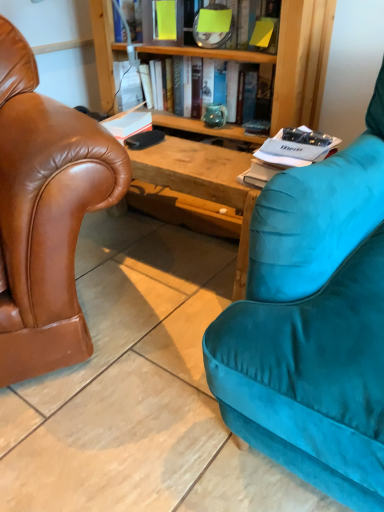
I want to click on white matte book at center, which appears as the 3th book when viewed from the top, so click(x=128, y=123).

Identify the location of matte ceramic vase at center. The image size is (384, 512). (215, 115).

Image resolution: width=384 pixels, height=512 pixels. What do you see at coordinates (287, 154) in the screenshot?
I see `white paper at right, marked as the 4th book in a top-to-bottom arrangement` at bounding box center [287, 154].

At what (x,y) coordinates should I click in order to perform the action: click on yellow paper at upper center, which is the first book in top-to-bottom order. Please return your answer as a coordinate pair (x, y). Looking at the image, I should click on (218, 35).

How much distance is there between white paper at right, marked as the 4th book in a top-to-bottom arrangement, and matte green vase at center, the 3th book when ordered from bottom to top?

white paper at right, marked as the 4th book in a top-to-bottom arrangement, and matte green vase at center, the 3th book when ordered from bottom to top, are 18.85 inches apart.

In the scene shown: Can you confirm if white paper at right, marked as the 4th book in a top-to-bottom arrangement, is positioned to the left of matte green vase at center, which is counted as the 2th book, starting from the top?

In fact, white paper at right, marked as the 4th book in a top-to-bottom arrangement, is to the right of matte green vase at center, which is counted as the 2th book, starting from the top.

From a real-world perspective, which book is the 1st one above the white paper at right, marked as the 4th book in a top-to-bottom arrangement? Please provide its 2D coordinates.

[(214, 55)]

From the image's perspective, does white paper at right, marked as the 4th book in a top-to-bottom arrangement, appear higher than matte green vase at center, which is counted as the 2th book, starting from the top?

No, from the image's perspective, white paper at right, marked as the 4th book in a top-to-bottom arrangement, is not on top of matte green vase at center, which is counted as the 2th book, starting from the top.

Can you tell me how much matte green vase at center, the 3th book when ordered from bottom to top, and white matte book at center, the 2th book when ordered from bottom to top, differ in facing direction?

There is a 5.5-degree angle between the facing directions of matte green vase at center, the 3th book when ordered from bottom to top, and white matte book at center, the 2th book when ordered from bottom to top.

Is matte green vase at center, the 3th book when ordered from bottom to top, wider or thinner than white matte book at center, the 2th book when ordered from bottom to top?

matte green vase at center, the 3th book when ordered from bottom to top, is thinner than white matte book at center, the 2th book when ordered from bottom to top.

Which is correct: matte green vase at center, which is counted as the 2th book, starting from the top, is inside white matte book at center, which appears as the 3th book when viewed from the top, or outside of it?

matte green vase at center, which is counted as the 2th book, starting from the top, is spatially situated outside white matte book at center, which appears as the 3th book when viewed from the top.

Where is `the 1st book below the matte green vase at center, which is counted as the 2th book, starting from the top (from the image's perspective)`? This screenshot has width=384, height=512. the 1st book below the matte green vase at center, which is counted as the 2th book, starting from the top (from the image's perspective) is located at coordinates (128, 123).

Can you tell me how much white matte book at center, the 2th book when ordered from bottom to top, and matte green vase at center, the 3th book when ordered from bottom to top, differ in facing direction?

There is a 5.5-degree angle between the facing directions of white matte book at center, the 2th book when ordered from bottom to top, and matte green vase at center, the 3th book when ordered from bottom to top.

Is white matte book at center, the 2th book when ordered from bottom to top, looking in the opposite direction of matte green vase at center, which is counted as the 2th book, starting from the top?

Yes, white matte book at center, the 2th book when ordered from bottom to top, is positioned with its back facing matte green vase at center, which is counted as the 2th book, starting from the top.

You are a GUI agent. You are given a task and a screenshot of the screen. Output one action in this format:
    pyautogui.click(x=<x>, y=<y>)
    Task: Click on the book that is the 1st one when counting rightward from the white matte book at center, the 2th book when ordered from bottom to top
    The width and height of the screenshot is (384, 512).
    Given the screenshot: What is the action you would take?
    pyautogui.click(x=214, y=55)

Is white matte book at center, the 2th book when ordered from bottom to top, closer to the viewer compared to matte green vase at center, the 3th book when ordered from bottom to top?

That is False.

Would you say white paper at right, the first book when ordered from bottom to top, is inside or outside matte ceramic vase at center?

white paper at right, the first book when ordered from bottom to top, is spatially situated outside matte ceramic vase at center.

Identify the location of book that is the 1st one above the matte ceramic vase at center (from a real-world perspective). This screenshot has height=512, width=384. (287, 154).

From a real-world perspective, relative to matte ceramic vase at center, is white paper at right, the first book when ordered from bottom to top, vertically above or below?

Clearly, from a real-world perspective, white paper at right, the first book when ordered from bottom to top, is above matte ceramic vase at center.

Is matte ceramic vase at center positioned behind yellow paper at upper center, the 4th book when ordered from bottom to top?

That is True.

Could you measure the distance between matte ceramic vase at center and yellow paper at upper center, the 4th book when ordered from bottom to top?

matte ceramic vase at center is 11.53 inches from yellow paper at upper center, the 4th book when ordered from bottom to top.

Can you confirm if matte ceramic vase at center is bigger than yellow paper at upper center, which is the first book in top-to-bottom order?

Actually, matte ceramic vase at center might be smaller than yellow paper at upper center, which is the first book in top-to-bottom order.

Is point (222, 121) farther from viewer compared to point (220, 44)?

Yes, point (222, 121) is behind point (220, 44).

Can you tell me how much white matte book at center, which appears as the 3th book when viewed from the top, and matte ceramic vase at center differ in facing direction?

5.5 degrees separate the facing orientations of white matte book at center, which appears as the 3th book when viewed from the top, and matte ceramic vase at center.

Considering the positions of points (115, 127) and (214, 108), is point (115, 127) farther from camera compared to point (214, 108)?

No, it is in front of (214, 108).

Based on the photo, considering the relative sizes of white matte book at center, which appears as the 3th book when viewed from the top, and matte ceramic vase at center in the image provided, is white matte book at center, which appears as the 3th book when viewed from the top, bigger than matte ceramic vase at center?

Indeed, white matte book at center, which appears as the 3th book when viewed from the top, has a larger size compared to matte ceramic vase at center.

Considering the positions of objects white matte book at center, which appears as the 3th book when viewed from the top, and matte ceramic vase at center in the image provided, who is behind, white matte book at center, which appears as the 3th book when viewed from the top, or matte ceramic vase at center?

matte ceramic vase at center is behind.

Does matte ceramic vase at center come in front of white paper at right, the first book when ordered from bottom to top?

That is False.

In the scene shown: Is matte ceramic vase at center inside the boundaries of white paper at right, marked as the 4th book in a top-to-bottom arrangement, or outside?

The correct answer is: outside.

From the image's perspective, is matte ceramic vase at center below white paper at right, the first book when ordered from bottom to top?

Incorrect, from the image's perspective, matte ceramic vase at center is higher than white paper at right, the first book when ordered from bottom to top.

I want to click on the 2nd book above when counting from the white paper at right, the first book when ordered from bottom to top (from the image's perspective), so click(214, 55).

At what (x,y) coordinates should I click in order to perform the action: click on the 1st book below the matte green vase at center, the 3th book when ordered from bottom to top (from the image's perspective). Please return your answer as a coordinate pair (x, y). Looking at the image, I should click on (128, 123).

From the image, which object appears to be farther from white matte book at center, the 2th book when ordered from bottom to top, yellow paper at upper center, the 4th book when ordered from bottom to top, or matte green vase at center, the 3th book when ordered from bottom to top?

yellow paper at upper center, the 4th book when ordered from bottom to top, is further to white matte book at center, the 2th book when ordered from bottom to top.

Which object lies further to the anchor point matte ceramic vase at center, yellow paper at upper center, which is the first book in top-to-bottom order, or white matte book at center, the 2th book when ordered from bottom to top?

white matte book at center, the 2th book when ordered from bottom to top.

When comparing their distances from matte green vase at center, which is counted as the 2th book, starting from the top, does yellow paper at upper center, which is the first book in top-to-bottom order, or white matte book at center, which appears as the 3th book when viewed from the top, seem closer?

yellow paper at upper center, which is the first book in top-to-bottom order, lies closer to matte green vase at center, which is counted as the 2th book, starting from the top, than the other object.

Estimate the real-world distances between objects in this image. Which object is further from yellow paper at upper center, which is the first book in top-to-bottom order, matte ceramic vase at center or matte green vase at center, which is counted as the 2th book, starting from the top?

matte ceramic vase at center is positioned further to the anchor yellow paper at upper center, which is the first book in top-to-bottom order.

When comparing their distances from white paper at right, marked as the 4th book in a top-to-bottom arrangement, does matte green vase at center, the 3th book when ordered from bottom to top, or yellow paper at upper center, which is the first book in top-to-bottom order, seem further?

The object further to white paper at right, marked as the 4th book in a top-to-bottom arrangement, is yellow paper at upper center, which is the first book in top-to-bottom order.

Looking at the image, which one is located further to white matte book at center, the 2th book when ordered from bottom to top, white paper at right, marked as the 4th book in a top-to-bottom arrangement, or matte green vase at center, the 3th book when ordered from bottom to top?

white paper at right, marked as the 4th book in a top-to-bottom arrangement, is further to white matte book at center, the 2th book when ordered from bottom to top.

Considering their positions, is white paper at right, the first book when ordered from bottom to top, positioned further to matte green vase at center, which is counted as the 2th book, starting from the top, than yellow paper at upper center, which is the first book in top-to-bottom order?

white paper at right, the first book when ordered from bottom to top, is positioned further to the anchor matte green vase at center, which is counted as the 2th book, starting from the top.

Which object lies further to the anchor point matte green vase at center, which is counted as the 2th book, starting from the top, white paper at right, marked as the 4th book in a top-to-bottom arrangement, or matte ceramic vase at center?

Among the two, white paper at right, marked as the 4th book in a top-to-bottom arrangement, is located further to matte green vase at center, which is counted as the 2th book, starting from the top.

Image resolution: width=384 pixels, height=512 pixels. Find the location of `teal that lies between yellow paper at upper center, which is the first book in top-to-bottom order, and white paper at right, marked as the 4th book in a top-to-bottom arrangement, from top to bottom`. teal that lies between yellow paper at upper center, which is the first book in top-to-bottom order, and white paper at right, marked as the 4th book in a top-to-bottom arrangement, from top to bottom is located at coordinates (215, 115).

Identify the location of teal between yellow paper at upper center, the 4th book when ordered from bottom to top, and white matte book at center, which appears as the 3th book when viewed from the top, vertically. The image size is (384, 512). (215, 115).

The image size is (384, 512). Identify the location of book that lies between yellow paper at upper center, which is the first book in top-to-bottom order, and matte ceramic vase at center from top to bottom. (214, 55).

Where is `book that lies between yellow paper at upper center, the 4th book when ordered from bottom to top, and white matte book at center, which appears as the 3th book when viewed from the top, from top to bottom`? Image resolution: width=384 pixels, height=512 pixels. book that lies between yellow paper at upper center, the 4th book when ordered from bottom to top, and white matte book at center, which appears as the 3th book when viewed from the top, from top to bottom is located at coordinates (214, 55).